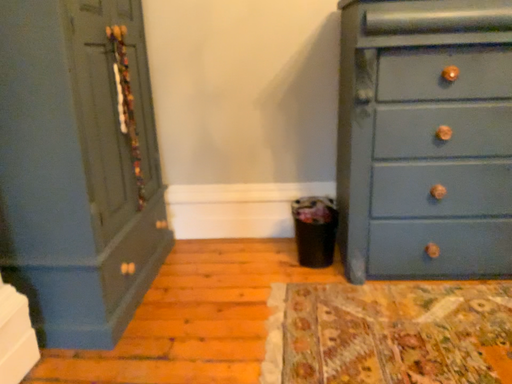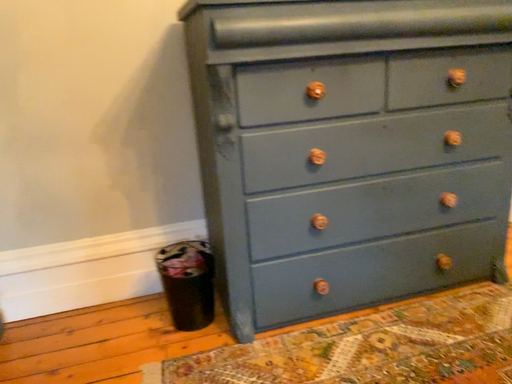
Question: How did the camera likely rotate when shooting the video?

Choices:
 (A) rotated right
 (B) rotated left

Answer: (A)